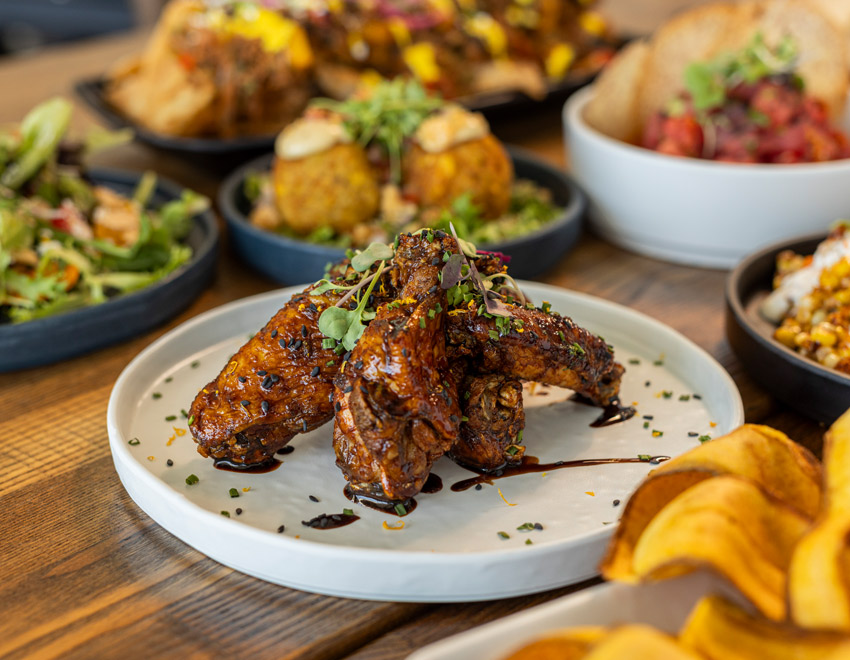
Where is `blue plate`? blue plate is located at coordinates (165, 303), (285, 264), (740, 319).